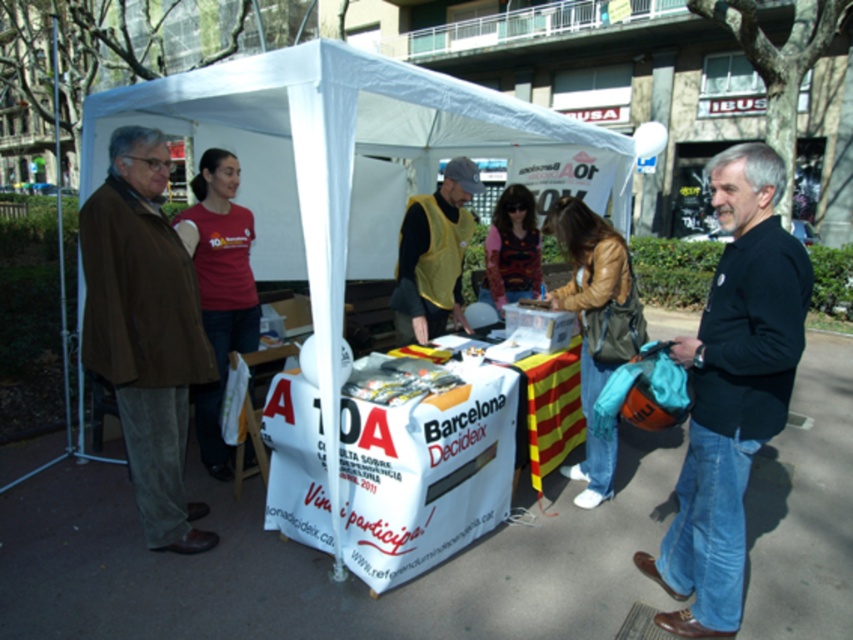
You are standing at the entrance of the tent and want to take a photo of both point (769, 253) and point (431, 308). Which point should you focus on first to ensure both are in the frame?

You should focus on point (769, 253) first because it is closer to the camera than point (431, 308), ensuring both points are within the frame.

You are organizing a photo shoot and need to place a small tripod between the black matte shirt at right and the yellow vest at center. Given their sizes, which object should the tripod be closer to?

The black matte shirt at right has a larger size compared to the yellow vest at center, so the tripod should be placed closer to the yellow vest at center to ensure enough space around both objects.

You are organizing a photo shoot and need to decide which participant to place in a narrow frame. The frame can only accommodate someone as wide as the narrower of the two objects. Which participant should you choose between the black matte shirt at right and the brown corduroy jacket at left?

The black matte shirt at right has a smaller width than the brown corduroy jacket at left, so you should choose the black matte shirt at right for the narrow frame.